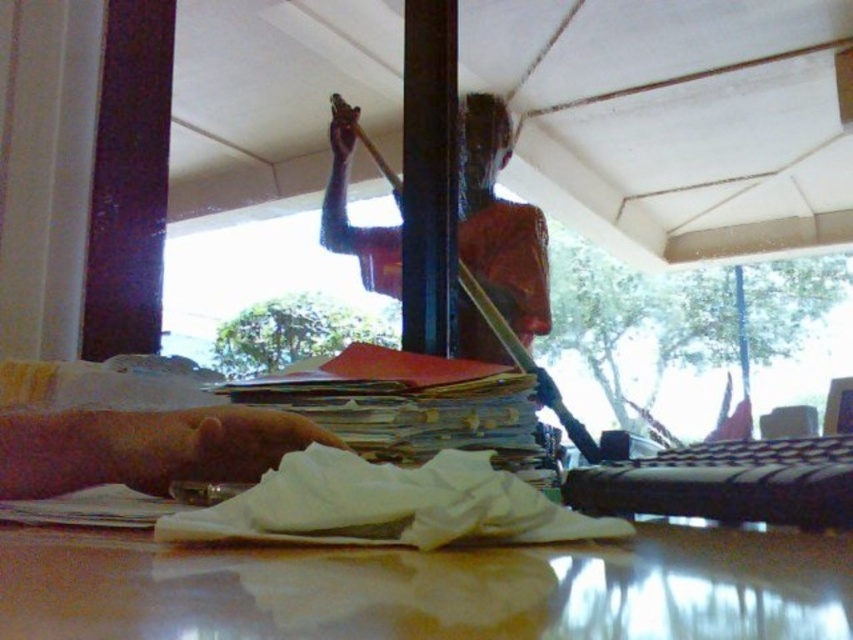
You are trying to place a small vase on the glossy wooden table at center without it falling off. Considering the smooth brown skin at upper center is above it, could the vase be placed safely?

The glossy wooden table at center is positioned under smooth brown skin at upper center, so placing the vase on the glossy wooden table at center might be unsafe because the smooth brown skin at upper center could knock it over.

You are a person with a height of 1.6 meters standing next to the glossy wooden table at center. Can you comfortably place your pink skin at lower left on the table without bending down?

The glossy wooden table at center has a lesser height compared to pink skin at lower left, so yes, you can comfortably place your pink skin at lower left on the table without bending down because the table is lower than the skin position.